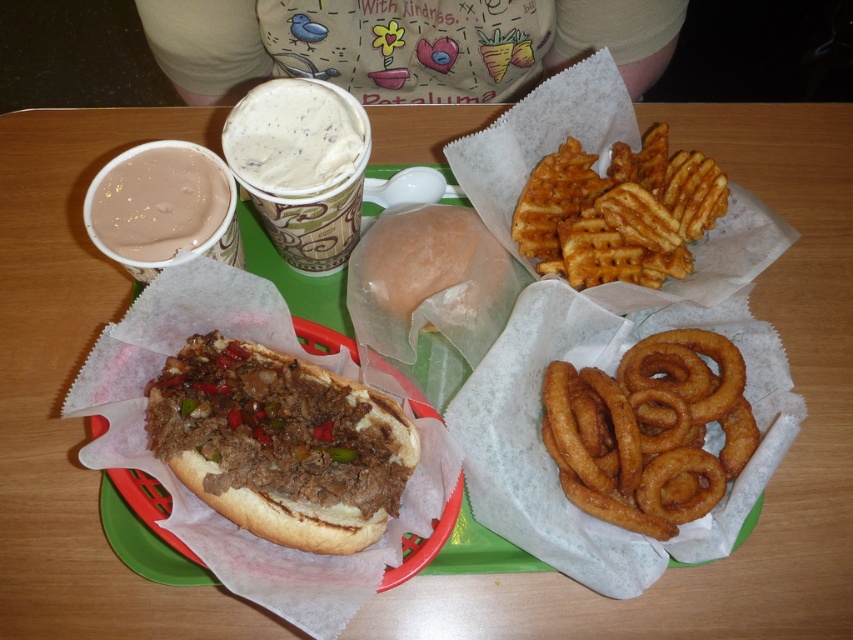
Is point (221, 340) positioned after point (106, 216)?

Yes, it is behind point (106, 216).

Is brown breaded meat at lower left behind smooth chocolate milkshake at upper left?

No, brown breaded meat at lower left is in front of smooth chocolate milkshake at upper left.

Does point (320, 436) lie behind point (213, 202)?

No, (320, 436) is closer to viewer.

The image size is (853, 640). Find the location of `brown breaded meat at lower left`. brown breaded meat at lower left is located at coordinates (281, 444).

Does brown breaded meat at lower left appear under light brown creamy cup at center?

Yes.

Does point (242, 340) come in front of point (349, 212)?

Yes, point (242, 340) is closer to viewer.

Identify the location of brown breaded meat at lower left. The height and width of the screenshot is (640, 853). (281, 444).

Is light brown creamy cup at center to the right of smooth chocolate milkshake at upper left from the viewer's perspective?

Correct, you'll find light brown creamy cup at center to the right of smooth chocolate milkshake at upper left.

Describe the element at coordinates (300, 166) in the screenshot. I see `light brown creamy cup at center` at that location.

Between point (300, 188) and point (178, 160), which one is positioned in front?

Point (300, 188) is more forward.

The image size is (853, 640). I want to click on light brown creamy cup at center, so click(300, 166).